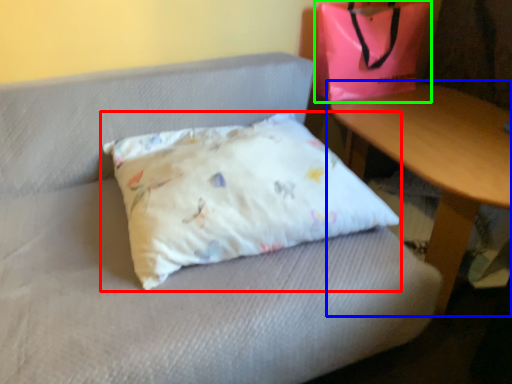
Question: Which is nearer to the pillow (highlighted by a red box)? table (highlighted by a blue box) or pouch (highlighted by a green box).

Choices:
 (A) table
 (B) pouch

Answer: (A)